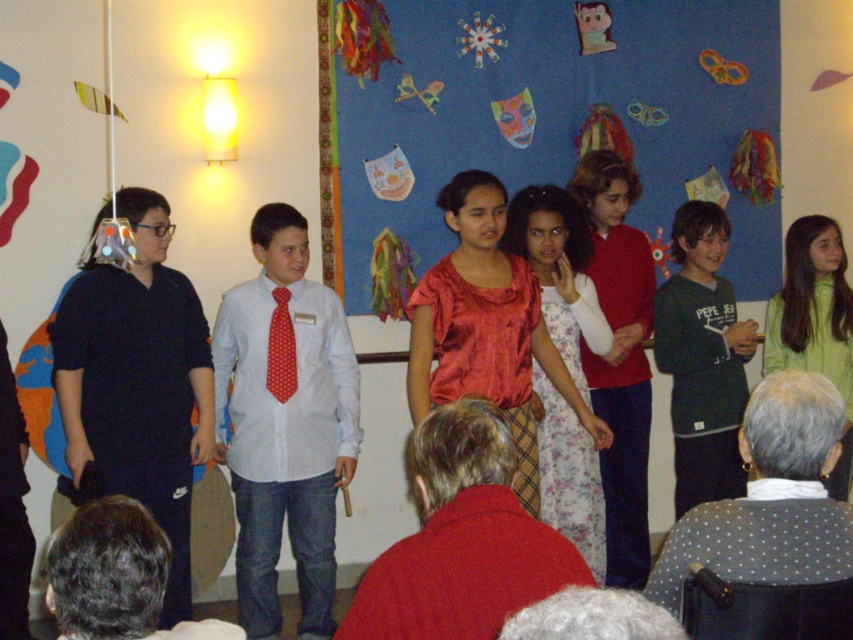
Can you confirm if red cotton sweater at center is wider than dark green jersey at center?

Indeed, red cotton sweater at center has a greater width compared to dark green jersey at center.

Which is above, red cotton sweater at center or dark green jersey at center?

dark green jersey at center is higher up.

Image resolution: width=853 pixels, height=640 pixels. What do you see at coordinates (461, 538) in the screenshot? I see `red cotton sweater at center` at bounding box center [461, 538].

Image resolution: width=853 pixels, height=640 pixels. Find the location of `red cotton sweater at center`. red cotton sweater at center is located at coordinates (461, 538).

Can you confirm if dark green jersey at center is positioned to the left of floral dress at center?

Incorrect, dark green jersey at center is not on the left side of floral dress at center.

The height and width of the screenshot is (640, 853). I want to click on dark green jersey at center, so click(701, 358).

Is point (682, 422) positioned in front of point (602, 339)?

No, (682, 422) is behind (602, 339).

Locate an element on the screen. dark green jersey at center is located at coordinates (701, 358).

Between satin fabric bulletin board at center and floral dress at center, which one has less height?

With less height is floral dress at center.

Is point (558, 22) behind point (543, 506)?

Yes.

The image size is (853, 640). Find the location of `satin fabric bulletin board at center`. satin fabric bulletin board at center is located at coordinates (541, 122).